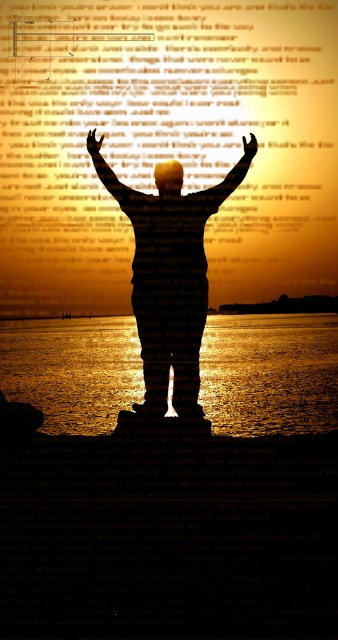
Question: Does silhouette figure at center appear under matte gold hand at upper center?

Choices:
 (A) yes
 (B) no

Answer: (A)

Question: Which point is farther to the camera?

Choices:
 (A) tap(281, 376)
 (B) tap(208, 189)
 (C) tap(171, 161)

Answer: (A)

Question: Which point appears closest to the camera in this image?

Choices:
 (A) (222, 193)
 (B) (129, 356)

Answer: (A)

Question: Does golden reflective water at center appear on the left side of silhouette arm at center?

Choices:
 (A) yes
 (B) no

Answer: (B)

Question: Which point is closer to the camera?

Choices:
 (A) (156, 173)
 (B) (131, 216)
 (C) (95, 150)

Answer: (B)

Question: Where is matte gold arm at upper center located in relation to matte gold candle at center in the image?

Choices:
 (A) below
 (B) above

Answer: (A)